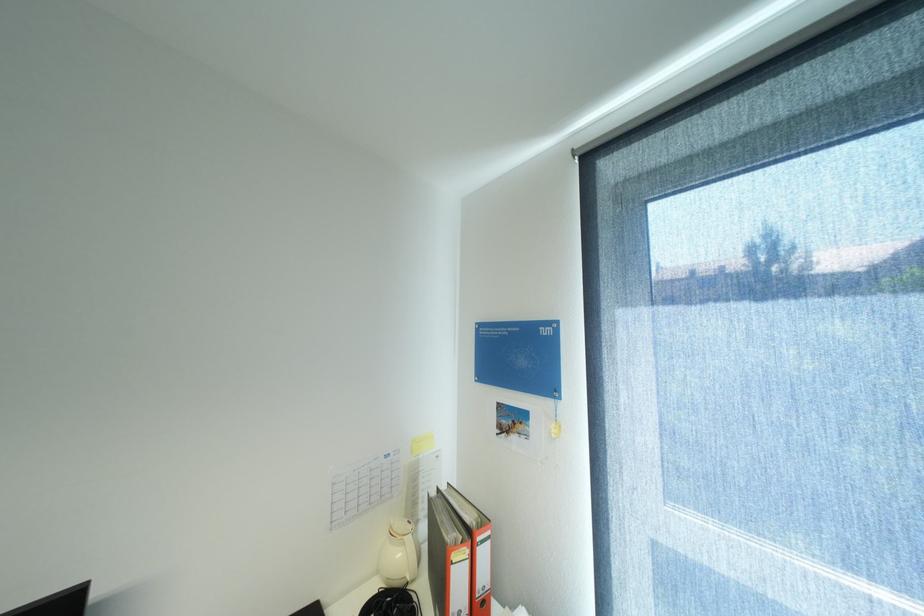
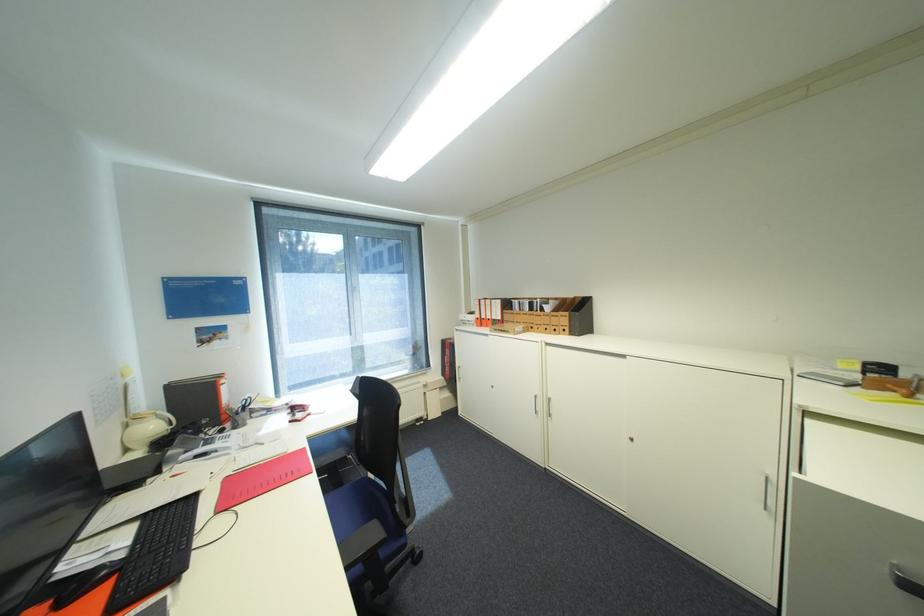
In the second image, find the point that corresponds to point 407,554 in the first image.

(161, 427)